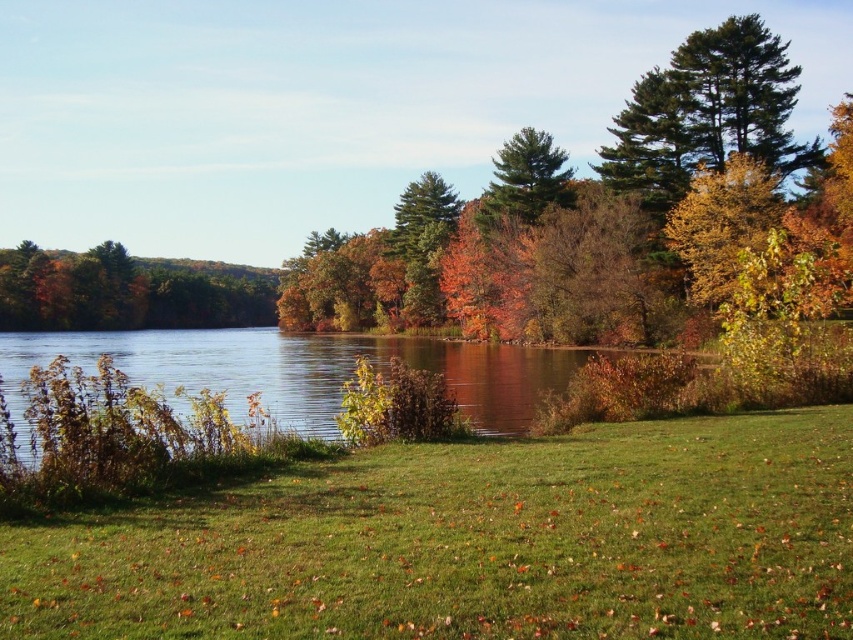
Between point (170, 508) and point (15, 328), which one is positioned behind?

Positioned behind is point (15, 328).

Is green grassy at lower center bigger than green matte tree at left?

Incorrect, green grassy at lower center is not larger than green matte tree at left.

I want to click on green grassy at lower center, so click(474, 541).

From the picture: Who is lower down, green leafy tree at upper right or green grassy lake at center?

green grassy lake at center is below.

Which is in front, point (508, 339) or point (90, 352)?

Point (90, 352) is more forward.

In order to click on green leafy tree at upper right in this screenshot , I will do `click(576, 214)`.

Is green grassy lake at center bigger than green matte tree at center?

Indeed, green grassy lake at center has a larger size compared to green matte tree at center.

Which of these two, green grassy lake at center or green matte tree at center, stands shorter?

green grassy lake at center

Locate an element on the screen. green grassy lake at center is located at coordinates (300, 371).